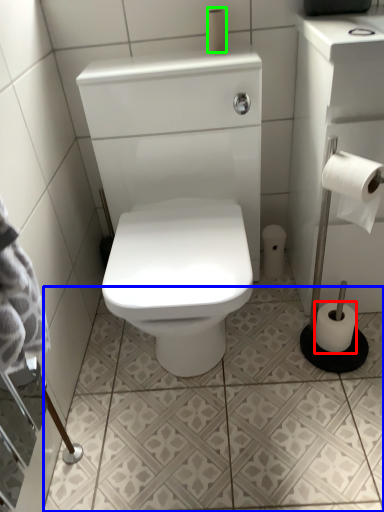
Question: Considering the real-world distances, which object is farthest from toilet paper (highlighted by a red box)? ceramic tile (highlighted by a blue box) or toilet paper (highlighted by a green box)?

Choices:
 (A) ceramic tile
 (B) toilet paper

Answer: (B)